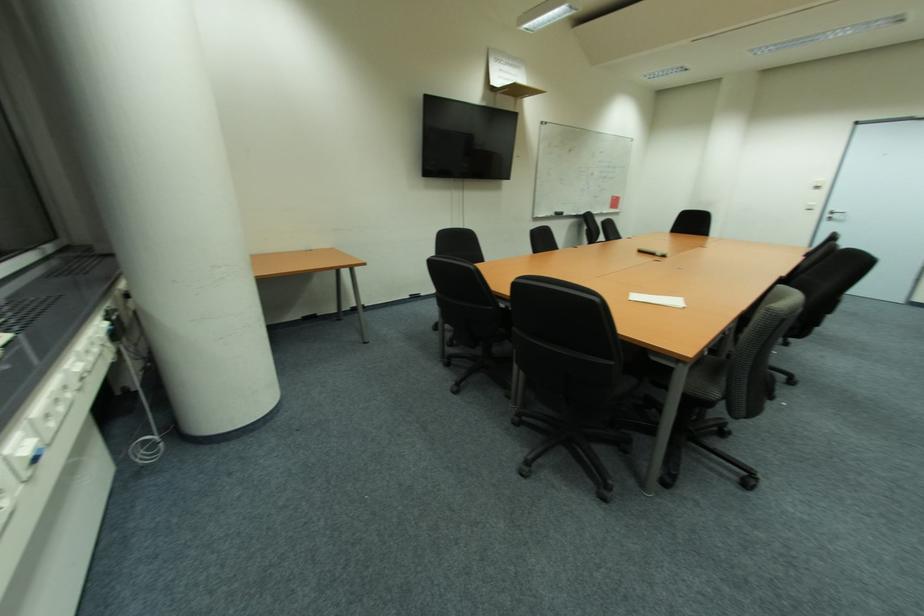
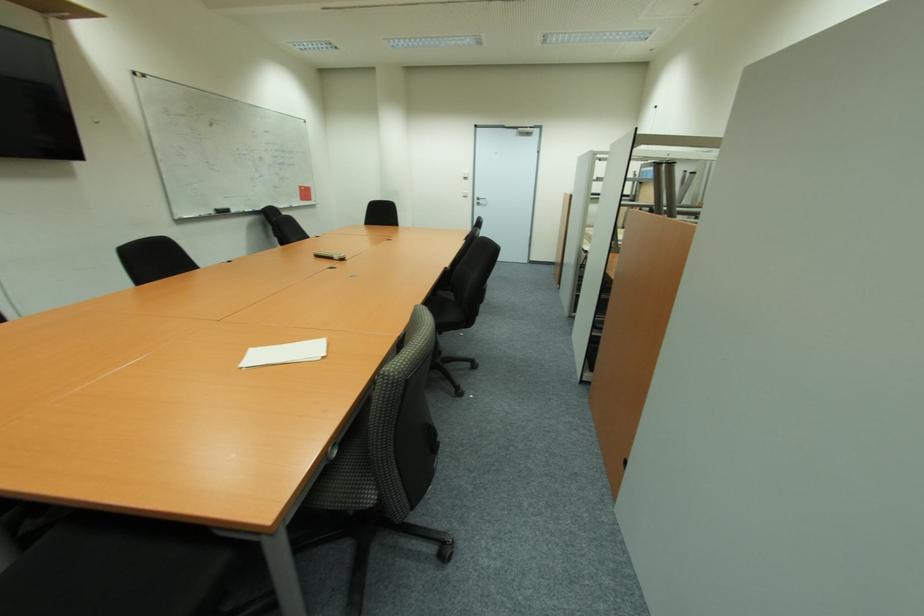
In the second image, find the point that corresponds to point (820, 188) in the first image.

(467, 179)